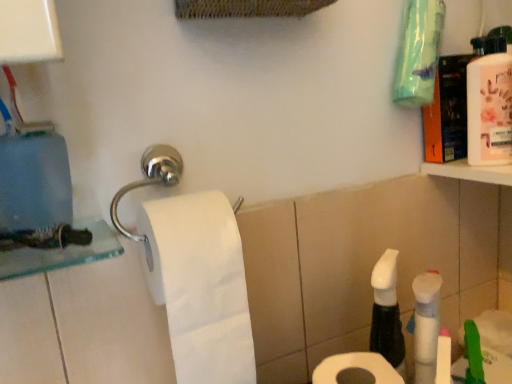
Question: Considering the positions of pink glossy mouthwash at upper right and white matte toilet paper at center, which is the 1th toilet paper in left-to-right order, in the image, is pink glossy mouthwash at upper right bigger or smaller than white matte toilet paper at center, which is the 1th toilet paper in left-to-right order,?

Choices:
 (A) big
 (B) small

Answer: (B)

Question: From the image's perspective, is pink glossy mouthwash at upper right positioned above or below white matte toilet paper at center, the 2th toilet paper in the right-to-left sequence?

Choices:
 (A) below
 (B) above

Answer: (B)

Question: Estimate the real-world distances between objects in this image. Which object is closer to the pink glossy mouthwash at upper right?

Choices:
 (A) white matte toilet paper at center, the 2th toilet paper in the right-to-left sequence
 (B) white matte toilet paper at lower center, the first toilet paper viewed from the right

Answer: (B)

Question: Considering the real-world distances, which object is closest to the pink glossy mouthwash at upper right?

Choices:
 (A) white matte toilet paper at center, the 2th toilet paper in the right-to-left sequence
 (B) white matte toilet paper at lower center, which is counted as the 2th toilet paper, starting from the left

Answer: (B)